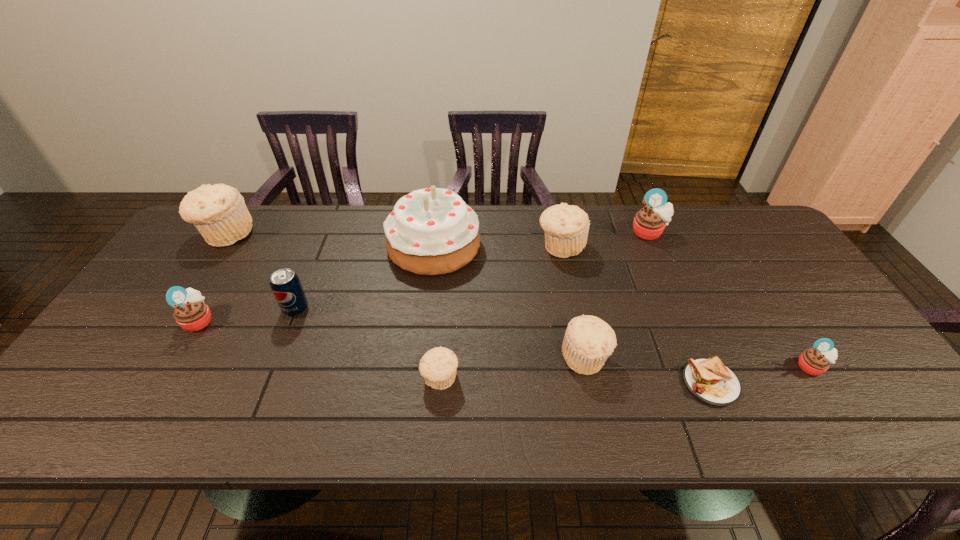
Where is `the rightmost muffin`? the rightmost muffin is located at coordinates (815, 361).

I want to click on the third muffin from left to right, so click(438, 366).

Where is `the smallest beige muffin`? This screenshot has height=540, width=960. the smallest beige muffin is located at coordinates (438, 366).

The height and width of the screenshot is (540, 960). In order to click on beige sandwich in this screenshot , I will do `click(709, 380)`.

I want to click on the shortest object, so click(709, 380).

At what (x,y) coordinates should I click in order to perform the action: click on vacant area located 0.100m on the front of the cake. Please return your answer as a coordinate pair (x, y). Image resolution: width=960 pixels, height=540 pixels. Looking at the image, I should click on (427, 303).

Find the location of a particular element. vacant space located 0.340m on the front of the biggest beige muffin is located at coordinates (156, 341).

Locate an element on the screen. vacant region located on the front-facing side of the second pink muffin from right to left is located at coordinates (665, 271).

Image resolution: width=960 pixels, height=540 pixels. I want to click on free region located on the front of the second biggest beige muffin, so [588, 373].

Image resolution: width=960 pixels, height=540 pixels. I want to click on free location located on the right of the eighth object from right to left, so click(x=339, y=309).